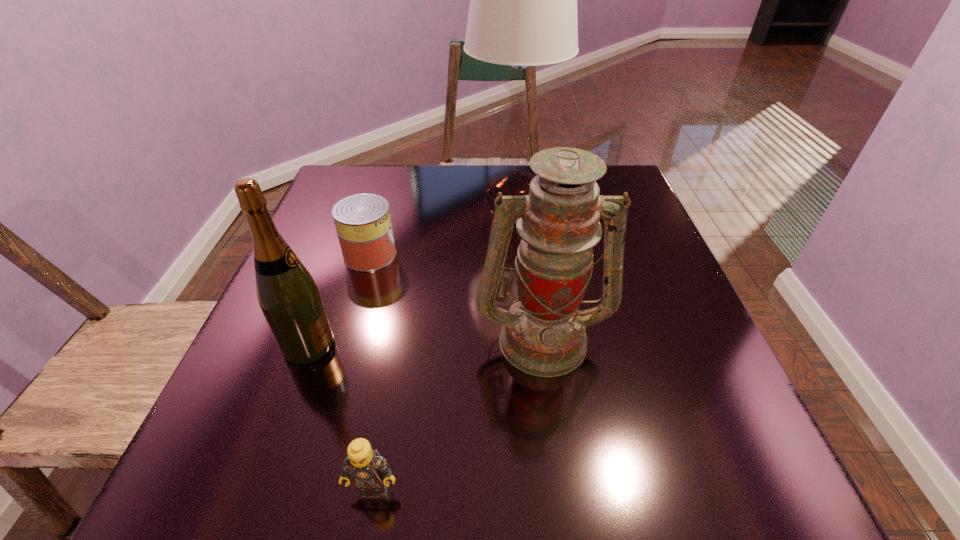
You are a GUI agent. You are given a task and a screenshot of the screen. Output one action in this format:
    pyautogui.click(x=<x>, y=<y>)
    Task: Click on the tallest object
    The width and height of the screenshot is (960, 540).
    Given the screenshot: What is the action you would take?
    [523, 0]

At what (x,y) coordinates should I click in order to perform the action: click on the farthest object. Please return your answer as a coordinate pair (x, y). The height and width of the screenshot is (540, 960). Looking at the image, I should click on (523, 0).

This screenshot has height=540, width=960. I want to click on oil lamp, so click(543, 334).

Find the location of a particular element. wine bottle is located at coordinates (288, 296).

Locate an element on the screen. The width and height of the screenshot is (960, 540). the fourth nearest object is located at coordinates (363, 223).

Locate an element on the screen. Lego is located at coordinates (369, 472).

Find the location of a particular element. Image resolution: width=960 pixels, height=540 pixels. the third object from right to left is located at coordinates (369, 472).

Find the location of `blank area located 0.280m on the front-facing side of the farthest object`. blank area located 0.280m on the front-facing side of the farthest object is located at coordinates (524, 299).

At what (x,y) coordinates should I click in order to perform the action: click on free space located 0.060m on the front of the oil lamp. Please return your answer as a coordinate pair (x, y). The width and height of the screenshot is (960, 540). Looking at the image, I should click on (552, 410).

In order to click on vacant space located 0.130m on the front-facing side of the wine bottle in this screenshot , I will do `click(406, 346)`.